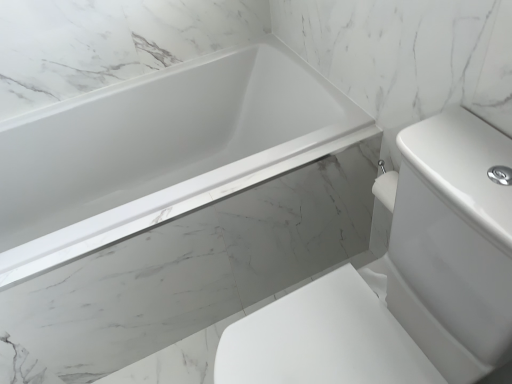
This screenshot has height=384, width=512. What do you see at coordinates (404, 280) in the screenshot? I see `white glossy sink at center` at bounding box center [404, 280].

Locate an element on the screen. The image size is (512, 384). white glossy sink at center is located at coordinates (404, 280).

Describe the element at coordinates (161, 150) in the screenshot. This screenshot has height=384, width=512. I see `white glossy bathtub at upper left` at that location.

Locate an element on the screen. The height and width of the screenshot is (384, 512). white glossy bathtub at upper left is located at coordinates (161, 150).

The image size is (512, 384). What are the coordinates of `white glossy sink at center` in the screenshot? It's located at (404, 280).

Considering the relative positions of white glossy bathtub at upper left and white glossy sink at center in the image provided, is white glossy bathtub at upper left to the right of white glossy sink at center from the viewer's perspective?

In fact, white glossy bathtub at upper left is to the left of white glossy sink at center.

Does white glossy bathtub at upper left lie in front of white glossy sink at center?

No, it is behind white glossy sink at center.

Is point (10, 201) behind point (497, 356)?

That is True.

From the image's perspective, would you say white glossy bathtub at upper left is positioned over white glossy sink at center?

Yes, from the image's perspective, white glossy bathtub at upper left is on top of white glossy sink at center.

From a real-world perspective, is white glossy bathtub at upper left positioned above or below white glossy sink at center?

From a real-world perspective, white glossy bathtub at upper left is physically below white glossy sink at center.

Between white glossy bathtub at upper left and white glossy sink at center, which one has smaller width?

Thinner between the two is white glossy bathtub at upper left.

From their relative heights in the image, would you say white glossy bathtub at upper left is taller or shorter than white glossy sink at center?

white glossy bathtub at upper left is shorter than white glossy sink at center.

Who is smaller, white glossy bathtub at upper left or white glossy sink at center?

With smaller size is white glossy sink at center.

Is white glossy sink at center surrounded by white glossy bathtub at upper left?

No, white glossy bathtub at upper left does not contain white glossy sink at center.

Are white glossy bathtub at upper left and white glossy sink at center beside each other?

No, white glossy bathtub at upper left is not touching white glossy sink at center.

Could you tell me if white glossy bathtub at upper left is facing white glossy sink at center?

Yes, white glossy bathtub at upper left is oriented towards white glossy sink at center.

What's the angular difference between white glossy bathtub at upper left and white glossy sink at center's facing directions?

The angle between the facing direction of white glossy bathtub at upper left and the facing direction of white glossy sink at center is 90.1 degrees.

Measure the distance from white glossy bathtub at upper left to white glossy sink at center.

white glossy bathtub at upper left and white glossy sink at center are 23.54 inches apart.

Where is `sink in front of the white glossy bathtub at upper left`? sink in front of the white glossy bathtub at upper left is located at coordinates (404, 280).

Based on their positions, is white glossy sink at center located to the left or right of white glossy bathtub at upper left?

white glossy sink at center is positioned on white glossy bathtub at upper left's right side.

Which object is further away from the camera, white glossy sink at center or white glossy bathtub at upper left?

white glossy bathtub at upper left is more distant.

Is point (248, 318) more distant than point (73, 120)?

No, it is in front of (73, 120).

From the image's perspective, is white glossy sink at center under white glossy bathtub at upper left?

Indeed, from the image's perspective, white glossy sink at center is shown beneath white glossy bathtub at upper left.

From a real-world perspective, is white glossy sink at center physically located above or below white glossy bathtub at upper left?

In terms of real-world spatial position, white glossy sink at center is above white glossy bathtub at upper left.

In terms of width, does white glossy sink at center look wider or thinner when compared to white glossy bathtub at upper left?

In the image, white glossy sink at center appears to be wider than white glossy bathtub at upper left.

In terms of height, does white glossy sink at center look taller or shorter compared to white glossy bathtub at upper left?

white glossy sink at center is taller than white glossy bathtub at upper left.

Considering the relative sizes of white glossy sink at center and white glossy bathtub at upper left in the image provided, is white glossy sink at center smaller than white glossy bathtub at upper left?

Yes.

Is white glossy bathtub at upper left located within white glossy sink at center?

Actually, white glossy bathtub at upper left is outside white glossy sink at center.

Would you say white glossy sink at center is a long distance from white glossy bathtub at upper left?

Actually, white glossy sink at center and white glossy bathtub at upper left are a little close together.

Is white glossy sink at center oriented towards white glossy bathtub at upper left?

No, white glossy sink at center is not facing towards white glossy bathtub at upper left.

Can you tell me how much white glossy sink at center and white glossy bathtub at upper left differ in facing direction?

There is a 90.1-degree angle between the facing directions of white glossy sink at center and white glossy bathtub at upper left.

How far apart are white glossy sink at center and white glossy bathtub at upper left?

white glossy sink at center and white glossy bathtub at upper left are 23.54 inches apart from each other.

Where is `sink above the white glossy bathtub at upper left (from a real-world perspective)`? The image size is (512, 384). sink above the white glossy bathtub at upper left (from a real-world perspective) is located at coordinates (404, 280).

In the image, there is a white glossy sink at center. At what (x,y) coordinates should I click in order to perform the action: click on bathtub below it (from a real-world perspective). Please return your answer as a coordinate pair (x, y). Image resolution: width=512 pixels, height=384 pixels. Looking at the image, I should click on (161, 150).

The height and width of the screenshot is (384, 512). I want to click on sink in front of the white glossy bathtub at upper left, so click(404, 280).